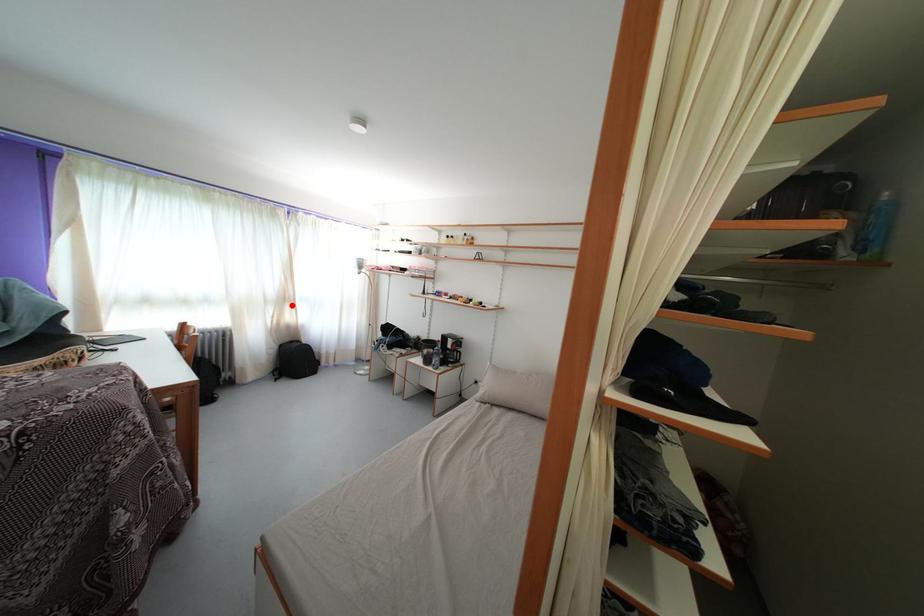
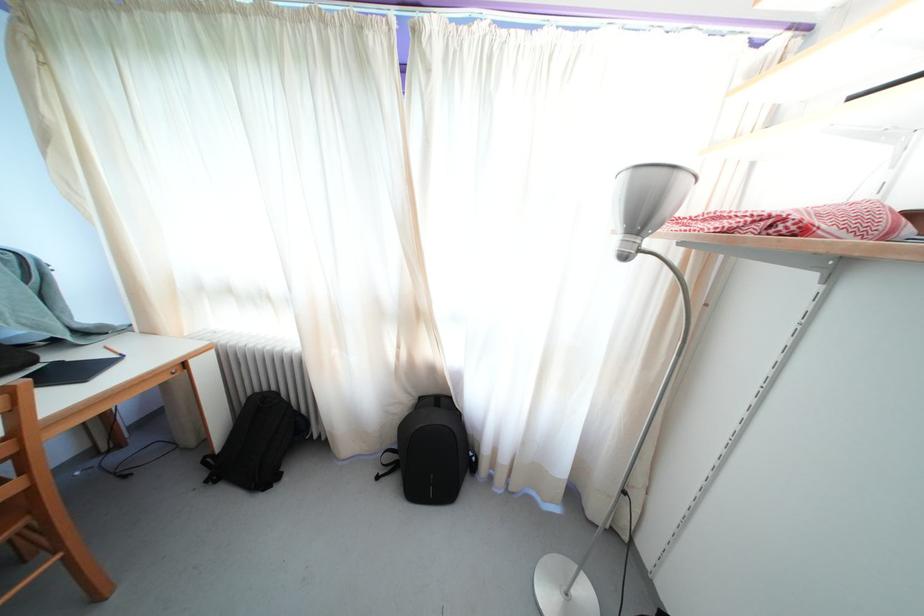
The point at the highlighted location is marked in the first image. Where is the corresponding point in the second image?

(421, 321)